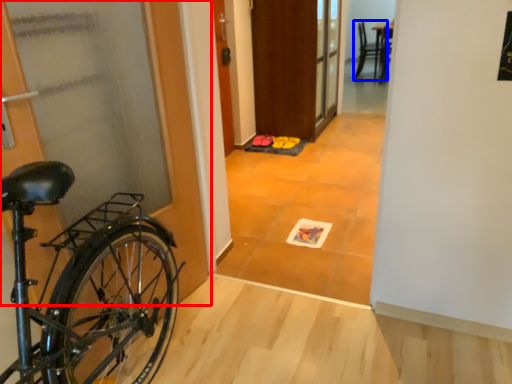
Question: Among these objects, which one is nearest to the camera, door (highlighted by a red box) or chair (highlighted by a blue box)?

Choices:
 (A) door
 (B) chair

Answer: (A)